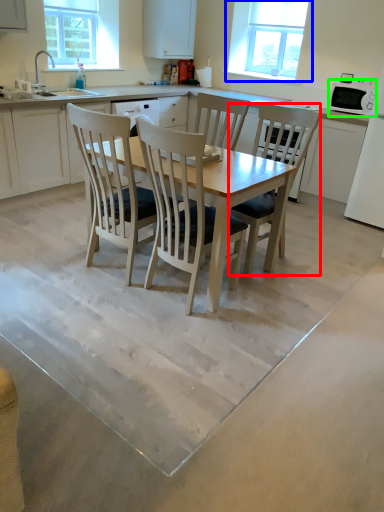
Question: Which object is positioned closest to chair (highlighted by a red box)? Select from window (highlighted by a blue box) and appliance (highlighted by a green box).

Choices:
 (A) window
 (B) appliance

Answer: (B)